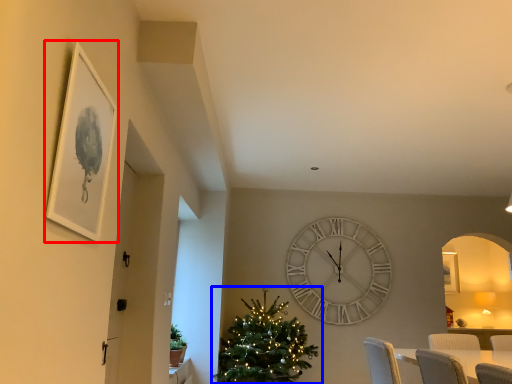
Question: Which of the following is the closest to the observer, picture frame (highlighted by a red box) or christmas tree (highlighted by a blue box)?

Choices:
 (A) picture frame
 (B) christmas tree

Answer: (A)